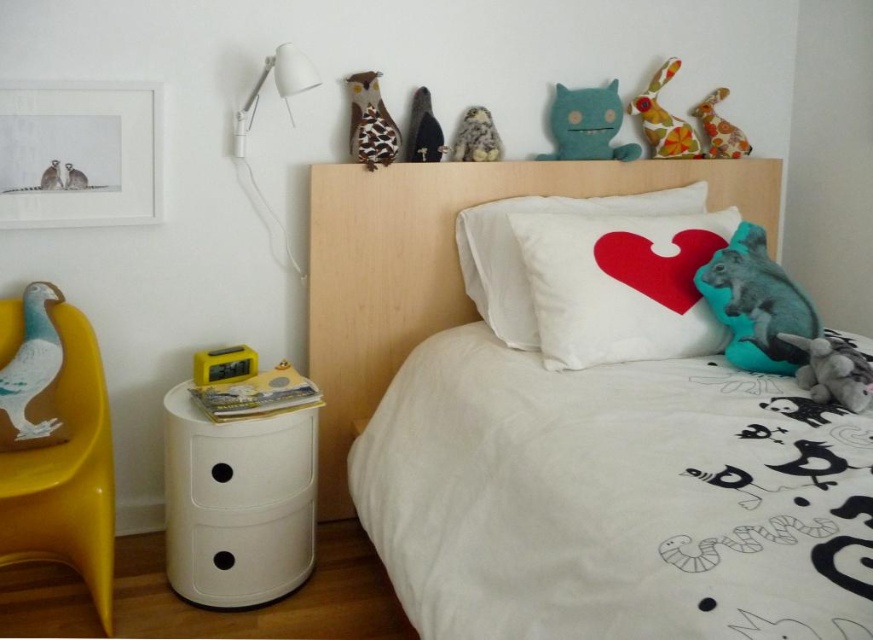
Question: Is white cotton bed at center smaller than matte gray cat at upper left?

Choices:
 (A) yes
 (B) no

Answer: (B)

Question: Considering the relative positions of teal plush toy at upper right and soft blue plush at upper center in the image provided, where is teal plush toy at upper right located with respect to soft blue plush at upper center?

Choices:
 (A) above
 (B) below

Answer: (B)

Question: Is textured brown owl at upper center thinner than yellow plastic clock at lower left?

Choices:
 (A) yes
 (B) no

Answer: (A)

Question: Which object is closer to the camera taking this photo?

Choices:
 (A) fuzzy fabric owl at upper center
 (B) soft blue plush at upper center
 (C) white cotton bed at center

Answer: (C)

Question: Among these points, which one is nearest to the camera?

Choices:
 (A) (715, 125)
 (B) (473, 161)
 (C) (603, 104)
 (D) (25, 417)

Answer: (D)

Question: Which object is farther from the camera taking this photo?

Choices:
 (A) white soft pillow at center
 (B) teal plush toy at upper right
 (C) matte gray cat at upper left
 (D) gray furry animal at upper left

Answer: (D)